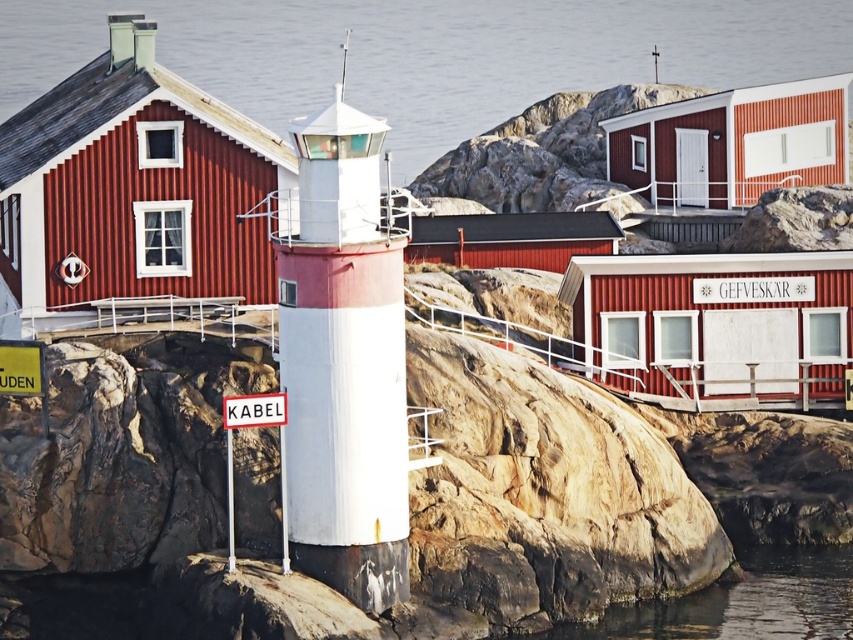
Between white wooden sign at center and yellow paper at lower left, which one is positioned lower?

yellow paper at lower left

Between point (708, 298) and point (10, 378), which one is positioned in front?

Point (10, 378)

Is point (729, 289) farther from camera compared to point (28, 380)?

Yes.

I want to click on white wooden sign at center, so click(x=752, y=289).

Between transparent water at center and matte red wooden hut at center right, which one appears on the right side from the viewer's perspective?

transparent water at center

Can you confirm if transparent water at center is positioned above matte red wooden hut at center right?

Yes.

Is point (70, 61) farther from camera compared to point (699, 344)?

Yes, it is.

Where is `transparent water at center`? transparent water at center is located at coordinates (431, 52).

Is matte red wooden hut at center right to the left of white wooden sign at center from the viewer's perspective?

Yes, matte red wooden hut at center right is to the left of white wooden sign at center.

Where is `matte red wooden hut at center right`? This screenshot has height=640, width=853. matte red wooden hut at center right is located at coordinates click(x=715, y=324).